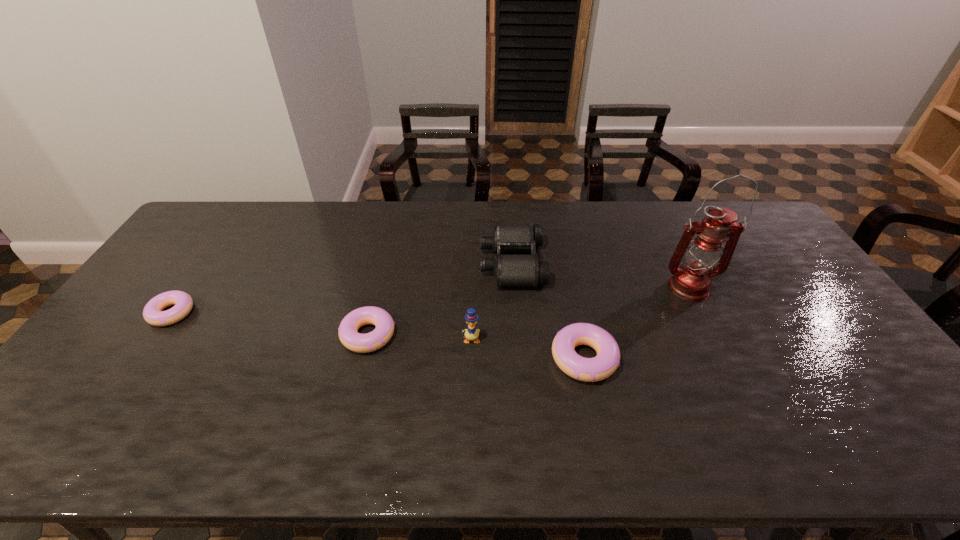
Image resolution: width=960 pixels, height=540 pixels. I want to click on object situated at the left edge, so click(x=152, y=313).

Where is `free region at the far edge of the desktop`? free region at the far edge of the desktop is located at coordinates (285, 231).

The width and height of the screenshot is (960, 540). In order to click on free spot at the near edge of the desktop in this screenshot , I will do `click(663, 387)`.

Locate an element on the screen. vacant space at the right edge of the desktop is located at coordinates (786, 289).

Identify the location of empty space that is in between the shortest object and the binoculars. The height and width of the screenshot is (540, 960). (342, 288).

The image size is (960, 540). I want to click on free area in between the second doughnut from left to right and the rightmost object, so click(528, 312).

Image resolution: width=960 pixels, height=540 pixels. In order to click on free space between the rightmost doughnut and the duckling in this screenshot , I will do `click(527, 349)`.

Find the location of a particular element. The image size is (960, 540). unoccupied area between the third object from left to right and the binoculars is located at coordinates (492, 301).

Find the location of a particular element. This screenshot has width=960, height=540. free spot between the second doughnut from right to left and the rightmost doughnut is located at coordinates (476, 347).

You are a GUI agent. You are given a task and a screenshot of the screen. Output one action in this format:
    pyautogui.click(x=<x>, y=<y>)
    Task: Click on the unoccupied area between the leftmost object and the fifth object from right to left
    Image resolution: width=960 pixels, height=540 pixels.
    Given the screenshot: What is the action you would take?
    pyautogui.click(x=270, y=324)